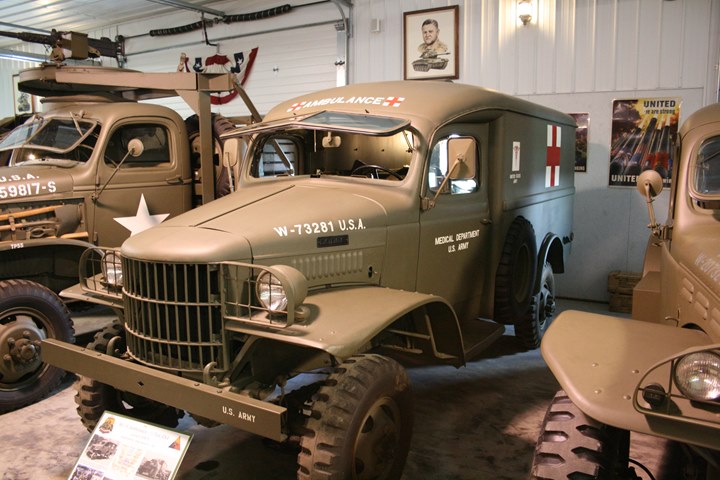
Where is `light reflections`? The width and height of the screenshot is (720, 480). light reflections is located at coordinates (461, 183), (18, 59), (294, 381), (486, 362), (548, 213).